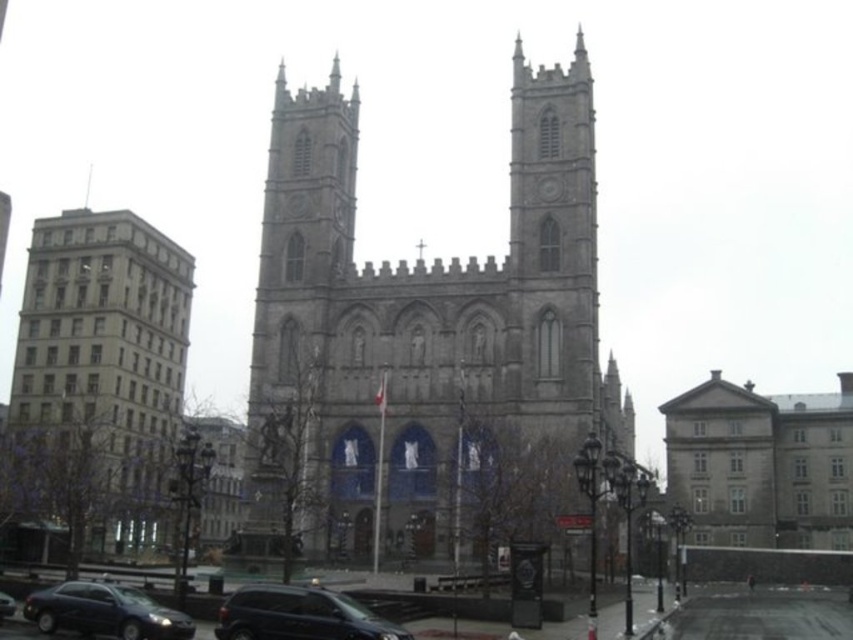
Question: Is shiny black suv at center closer to the viewer compared to matte black sedan at lower left?

Choices:
 (A) yes
 (B) no

Answer: (A)

Question: Which point is farther to the camera?

Choices:
 (A) (556, 426)
 (B) (357, 636)
 (C) (132, 499)

Answer: (C)

Question: Can you confirm if shiny black suv at center is positioned above matte black car at center?

Choices:
 (A) yes
 (B) no

Answer: (A)

Question: Among these points, which one is farthest from the camera?

Choices:
 (A) (6, 608)
 (B) (91, 625)
 (C) (103, 404)
 (D) (587, 412)

Answer: (C)

Question: Which object is farther from the camera taking this photo?

Choices:
 (A) gray stone church at right
 (B) matte black sedan at lower left
 (C) shiny black suv at center
 (D) matte black car at center

Answer: (A)

Question: Can you confirm if gray stone church at center is wider than matte black car at center?

Choices:
 (A) yes
 (B) no

Answer: (A)